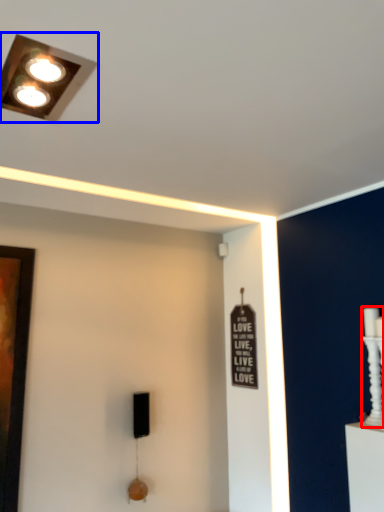
Question: Which of the following is the farthest to the observer, candle holder (highlighted by a red box) or lamp (highlighted by a blue box)?

Choices:
 (A) candle holder
 (B) lamp

Answer: (A)